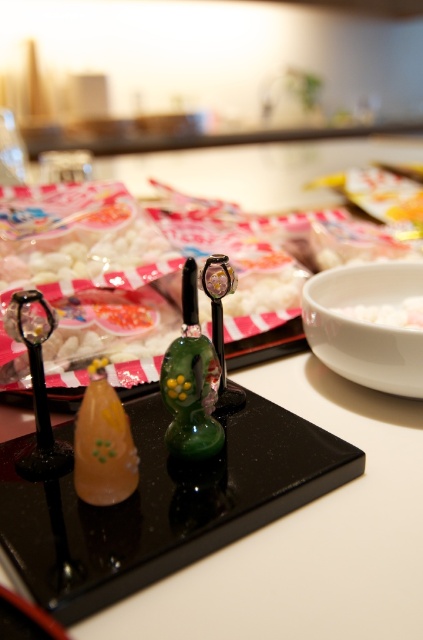
You are organizing a small display and need to place a 10cm wide decorative item. You have a translucent orange glass at left and a white matte rice at center. Which item can accommodate the 10cm wide item based on their widths?

The white matte rice at center has a greater width than the translucent orange glass at left, so the 10cm wide item can be placed on the white matte rice at center.

You are arranging items on a shelf and want to place the green glass figurine at center and the translucent orange glass at left next to each other. Given that the shelf has limited space, which of the two items requires more horizontal space?

The translucent orange glass at left requires more horizontal space because its width is greater than the green glass figurine at center.

You are arranging items on a shelf and see the green glass figurine at center and the translucent orange glass at left. Which one is positioned to the right of the other?

The green glass figurine at center is positioned to the right of the translucent orange glass at left.